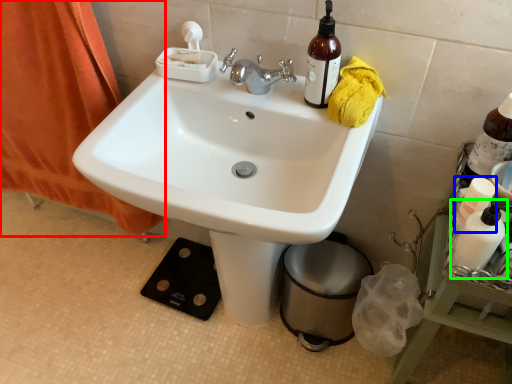
Question: Based on their relative distances, which object is nearer to curtain (highlighted by a red box)? Choose from bottle (highlighted by a blue box) and mouthwash (highlighted by a green box).

Choices:
 (A) bottle
 (B) mouthwash

Answer: (A)